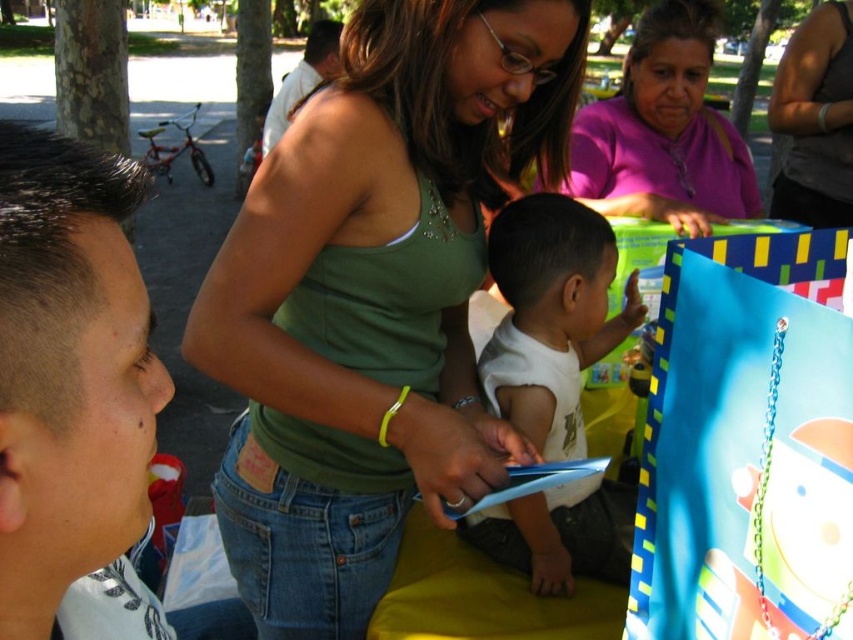
You are at a park event and see a woman and a child. The woman has short hair at left and the child wears a white matte shirt at center. From the perspective of the woman, which object is on the right side?

The white matte shirt at center is to the right of the short hair at left from the woman perspective.

Based on the scene described, which object, the short hair at left or the light brown leather jacket at upper center, is smaller in size?

The short hair at left is smaller in size compared to the light brown leather jacket at upper center.

You are standing at the position of the point labeled as point (322, 22) and want to walk towards the point labeled as point (705, 132). Based on the scene description, will you have to walk forward or backward to reach your destination?

You will have to walk forward to reach point (705, 132) because it is in front of point (322, 22) according to the spatial description provided.